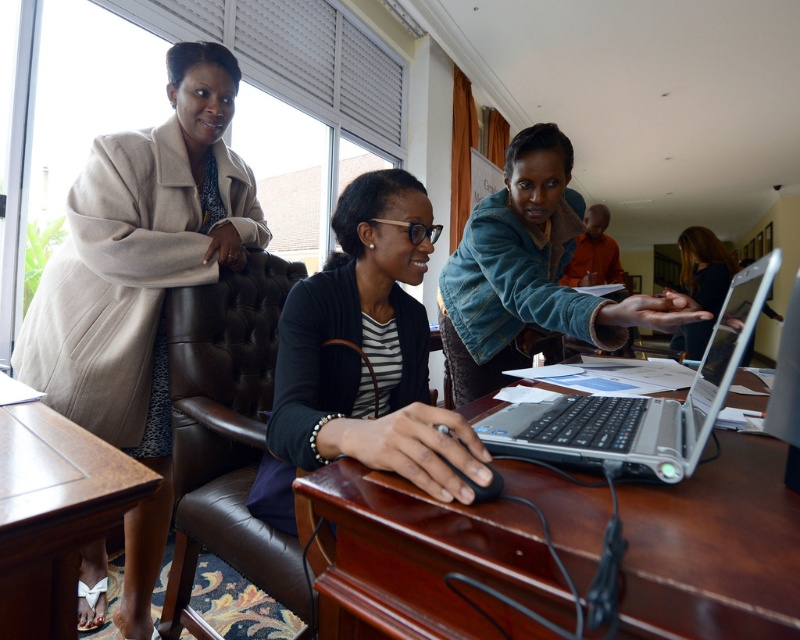
You are sitting at the brown wooden table at center in an office. You need to hand a document to the person wearing the orange fabric shirt at upper center. Can you reach them directly from your current position without moving around the table?

The brown wooden table at center is in front of orange fabric shirt at upper center, so you cannot reach them directly without moving around the table since the table is blocking the path.

You are an interior designer planning to hang a coat rack in this office. The beige wool coat at upper left and the smooth black hair at center are currently in the way. Which object should you move to make space for the coat rack?

The beige wool coat at upper left is much taller than the smooth black hair at center, so you should move the beige wool coat at upper left to make space for the coat rack.

You are a delivery person who needs to place a package between the beige wool coat at upper left and the smooth black hair at center. The package requires 10 feet of space. Can you fit it there?

The beige wool coat at upper left and smooth black hair at center are 9.64 feet apart from each other. Since the required space for the package is 10 feet, which is more than the available distance, the package cannot be placed there.